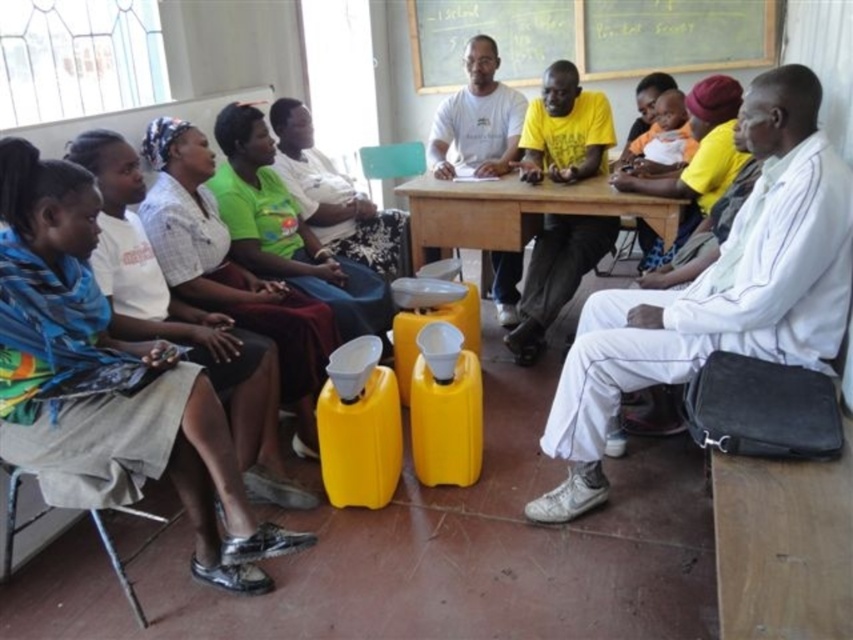
Consider the image. Can you confirm if white fabric bag at right is taller than green fabric shirt at center?

Yes, white fabric bag at right is taller than green fabric shirt at center.

Image resolution: width=853 pixels, height=640 pixels. What are the coordinates of `white fabric bag at right` in the screenshot? It's located at (717, 292).

Between white fabric bag at right and white matte shirt at center, which one is positioned higher?

Positioned higher is white matte shirt at center.

Can you confirm if white fabric bag at right is positioned to the left of white matte shirt at center?

Incorrect, white fabric bag at right is not on the left side of white matte shirt at center.

The width and height of the screenshot is (853, 640). I want to click on white fabric bag at right, so click(717, 292).

Find the location of `white fabric bag at right`. white fabric bag at right is located at coordinates [x=717, y=292].

Can you confirm if matte blue scarf at left is taller than wooden table at center?

Yes.

Is matte blue scarf at left above wooden table at center?

No.

Which is behind, point (15, 150) or point (663, 220)?

Point (663, 220)

Find the location of a particular element. This screenshot has height=640, width=853. matte blue scarf at left is located at coordinates (109, 374).